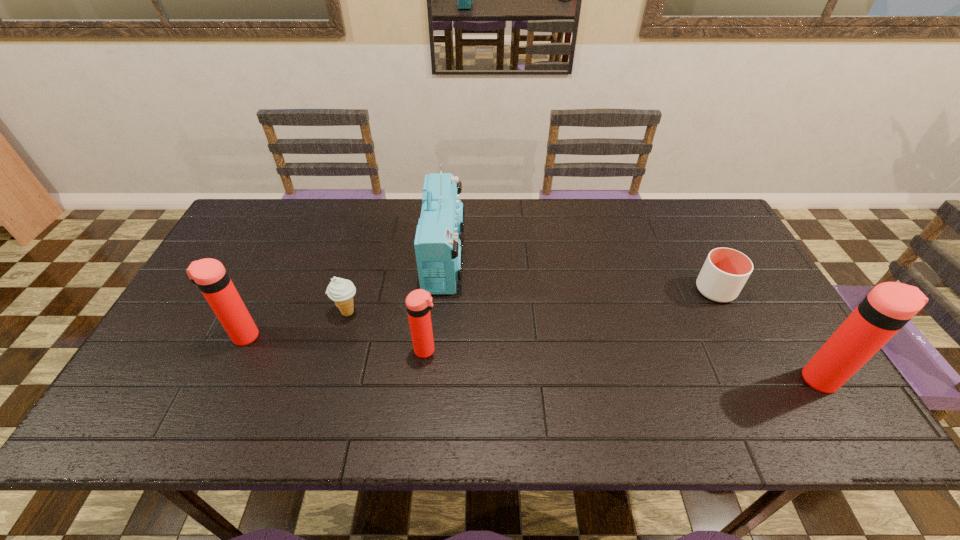
To make them evenly spaced by inserting another thermos_bottle among them, please locate a vacant spot for this new thermos_bottle. Please provide its 2D coordinates. Your answer should be formatted as a tuple, i.e. [(x, y)], where the tuple contains the x and y coordinates of a point satisfying the conditions above.

[(618, 364)]